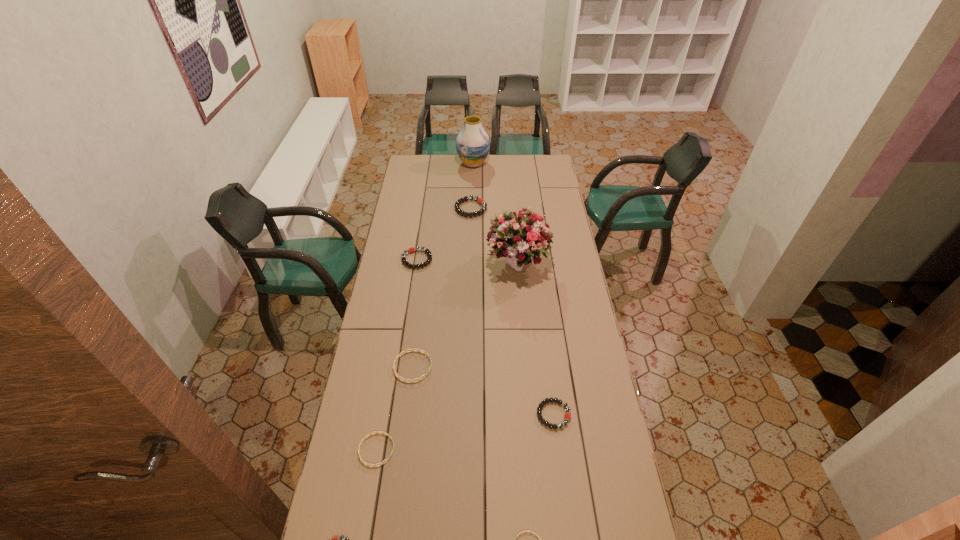
Locate an element on the screen. The image size is (960, 540). the farthest object is located at coordinates tap(472, 144).

Locate an element on the screen. pink bouquet is located at coordinates (514, 236).

Where is `the tallest bracelet`? The height and width of the screenshot is (540, 960). the tallest bracelet is located at coordinates (481, 201).

Find the location of a particular element. The height and width of the screenshot is (540, 960). the biggest black bracelet is located at coordinates (481, 201).

Locate an element on the screen. the third smallest black bracelet is located at coordinates (410, 250).

Identify the location of the sixth shortest bracelet. (410, 250).

Locate an element on the screen. The image size is (960, 540). the farthest blue bracelet is located at coordinates (419, 350).

Find the location of `the biggest blue bracelet`. the biggest blue bracelet is located at coordinates (419, 350).

At what (x,y) coordinates should I click in order to perform the action: click on the second smallest black bracelet. Please return your answer as a coordinate pair (x, y). The width and height of the screenshot is (960, 540). Looking at the image, I should click on (567, 416).

Identify the location of the rightmost bracelet. Image resolution: width=960 pixels, height=540 pixels. (567, 416).